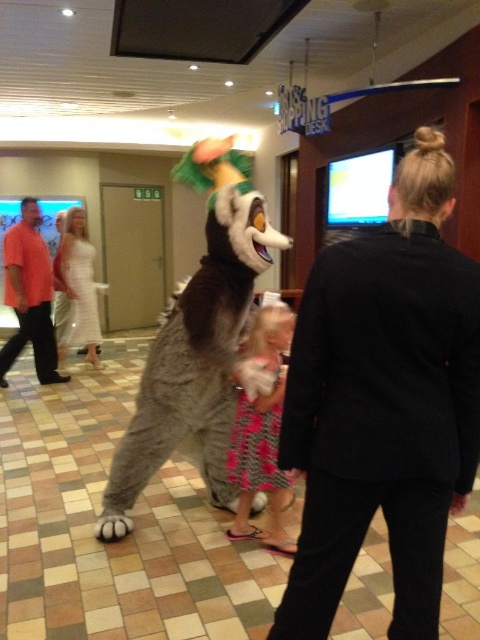
Is pink fabric dress at center wider than pink textured dress at center?

Yes, pink fabric dress at center is wider than pink textured dress at center.

Is point (256, 531) positioned in front of point (255, 406)?

No.

Where is `pink fabric dress at center`? This screenshot has width=480, height=640. pink fabric dress at center is located at coordinates (262, 432).

Based on the photo, who is more forward, (399, 221) or (245, 417)?

Positioned in front is point (399, 221).

Is point (377, 368) in front of point (268, 420)?

That is True.

The image size is (480, 640). Identify the location of black textured blazer at center. (384, 403).

Looking at this image, which is above, pink fabric dress at center or white satin dress at center?

Positioned higher is white satin dress at center.

I want to click on pink fabric dress at center, so pos(262,432).

This screenshot has height=640, width=480. What are the coordinates of `pink fabric dress at center` in the screenshot? It's located at (262, 432).